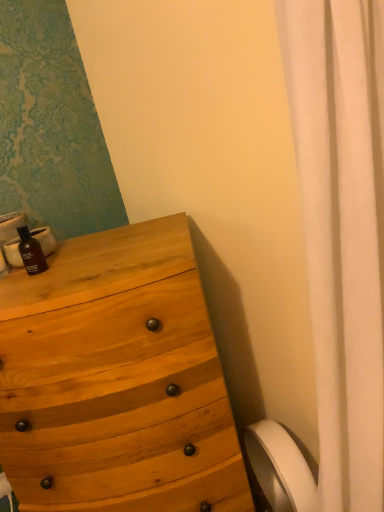
Question: Are matte black bottle at left and white matte toilet paper at lower right beside each other?

Choices:
 (A) no
 (B) yes

Answer: (A)

Question: From a real-world perspective, is matte black bottle at left below white matte toilet paper at lower right?

Choices:
 (A) yes
 (B) no

Answer: (B)

Question: Does matte black bottle at left contain white matte toilet paper at lower right?

Choices:
 (A) yes
 (B) no

Answer: (B)

Question: Does matte black bottle at left appear on the left side of white matte toilet paper at lower right?

Choices:
 (A) no
 (B) yes

Answer: (B)

Question: Is matte black bottle at left facing towards white matte toilet paper at lower right?

Choices:
 (A) no
 (B) yes

Answer: (A)

Question: Looking at their shapes, would you say white matte toilet paper at lower right is wider or thinner than matte black bottle at left?

Choices:
 (A) wide
 (B) thin

Answer: (A)

Question: From their relative heights in the image, would you say white matte toilet paper at lower right is taller or shorter than matte black bottle at left?

Choices:
 (A) tall
 (B) short

Answer: (A)

Question: Does point (289, 476) appear closer or farther from the camera than point (29, 258)?

Choices:
 (A) farther
 (B) closer

Answer: (A)

Question: In terms of size, does white matte toilet paper at lower right appear bigger or smaller than matte black bottle at left?

Choices:
 (A) big
 (B) small

Answer: (A)

Question: Looking at the image, does matte black bottle at left seem bigger or smaller compared to white matte toilet paper at lower right?

Choices:
 (A) big
 (B) small

Answer: (B)

Question: Is point (19, 239) closer or farther from the camera than point (276, 503)?

Choices:
 (A) farther
 (B) closer

Answer: (B)

Question: In terms of width, does matte black bottle at left look wider or thinner when compared to white matte toilet paper at lower right?

Choices:
 (A) wide
 (B) thin

Answer: (B)

Question: From a real-world perspective, is matte black bottle at left above or below white matte toilet paper at lower right?

Choices:
 (A) below
 (B) above

Answer: (B)

Question: Is point (38, 245) closer or farther from the camera than point (135, 359)?

Choices:
 (A) closer
 (B) farther

Answer: (B)

Question: From a real-world perspective, is matte black bottle at left physically located above or below natural wood chest of drawers at left?

Choices:
 (A) above
 (B) below

Answer: (A)